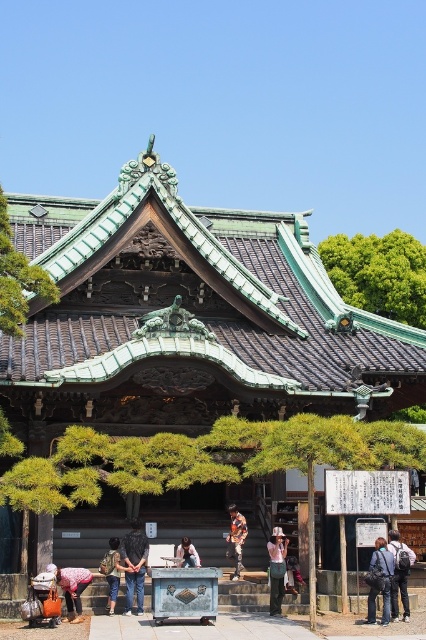
Is matte brown pants at lower left smaller than light brown fabric jacket at center?

Incorrect, matte brown pants at lower left is not smaller in size than light brown fabric jacket at center.

Is matte brown pants at lower left below light brown fabric jacket at center?

Yes.

What are the coordinates of `matte brown pants at lower left` in the screenshot? It's located at (71, 588).

Where is `matte brown pants at lower left`? The height and width of the screenshot is (640, 426). matte brown pants at lower left is located at coordinates (71, 588).

Can you confirm if wooden hat at center is smaller than light brown leather jacket at center?

Correct, wooden hat at center occupies less space than light brown leather jacket at center.

Is point (279, 604) closer to viewer compared to point (103, 564)?

That is True.

I want to click on wooden hat at center, so click(x=276, y=568).

Is dark blue jeans at center taller than wooden hat at center?

Indeed, dark blue jeans at center has a greater height compared to wooden hat at center.

Locate an element on the screen. dark blue jeans at center is located at coordinates (134, 564).

The height and width of the screenshot is (640, 426). In order to click on dark blue jeans at center in this screenshot , I will do `click(134, 564)`.